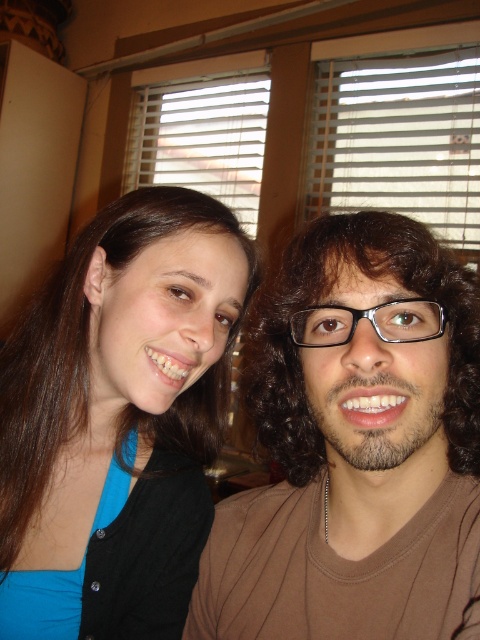
You are a photographer adjusting camera settings. You need to ensure both the brown matte shirt at center and the blue fabric shirt at upper left are fully visible in the frame. Which shirt should you focus on first to avoid cropping the shorter one?

The brown matte shirt at center is shorter than the blue fabric shirt at upper left, so you should focus on the brown matte shirt at center first to ensure it is fully visible in the frame before adjusting for the taller blue fabric shirt at upper left.

Looking at this image, you are organizing a clothing display and need to place the brown matte shirt at center and the blue fabric shirt at upper left on a rack. Which shirt should you place on the narrower hanger?

The brown matte shirt at center has a lesser width compared to the blue fabric shirt at upper left, so it should be placed on the narrower hanger.

You are a photographer setting up for a group photo and need to ensure there is enough space between the subjects. The minimum required distance between the two subjects is 5 inches. Can the subjects represented by the brown matte shirt at center and the blue fabric shirt at upper left maintain the required distance?

The brown matte shirt at center and the blue fabric shirt at upper left are 5.57 inches apart from each other, which exceeds the minimum required distance of 5 inches. Therefore, the subjects can maintain the required distance.